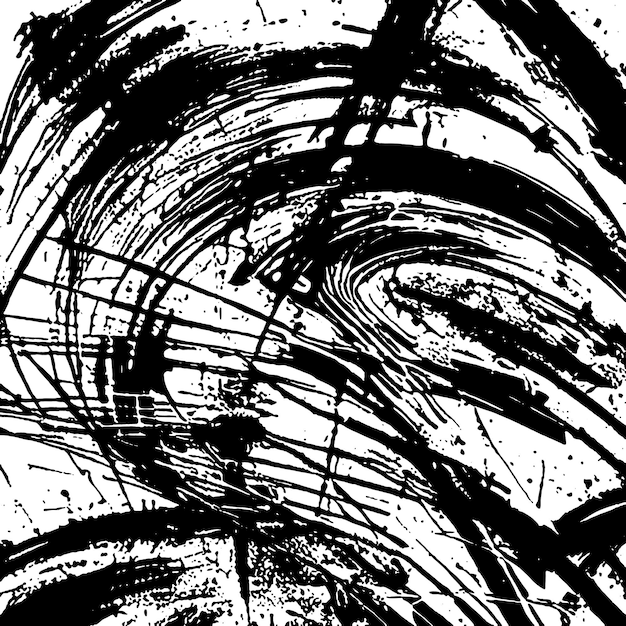
Identify the location of art. [346, 593], [476, 178].